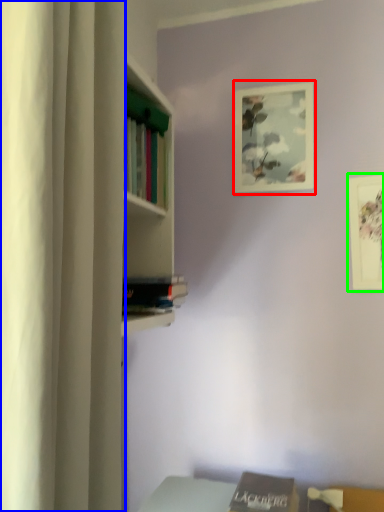
Question: Estimate the real-world distances between objects in this image. Which object is closer to picture frame (highlighted by a red box), curtain (highlighted by a blue box) or picture frame (highlighted by a green box)?

Choices:
 (A) curtain
 (B) picture frame

Answer: (B)